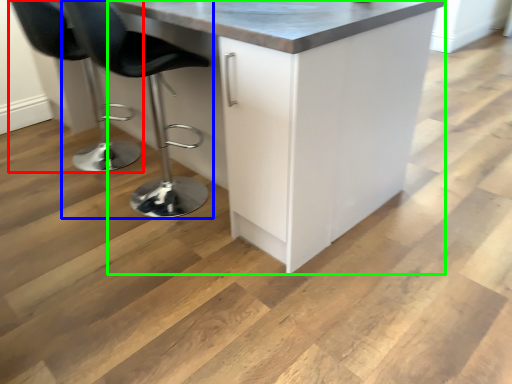
Question: Estimate the real-world distances between objects in this image. Which object is farther from chair (highlighted by a red box), chair (highlighted by a blue box) or cabinetry (highlighted by a green box)?

Choices:
 (A) chair
 (B) cabinetry

Answer: (B)